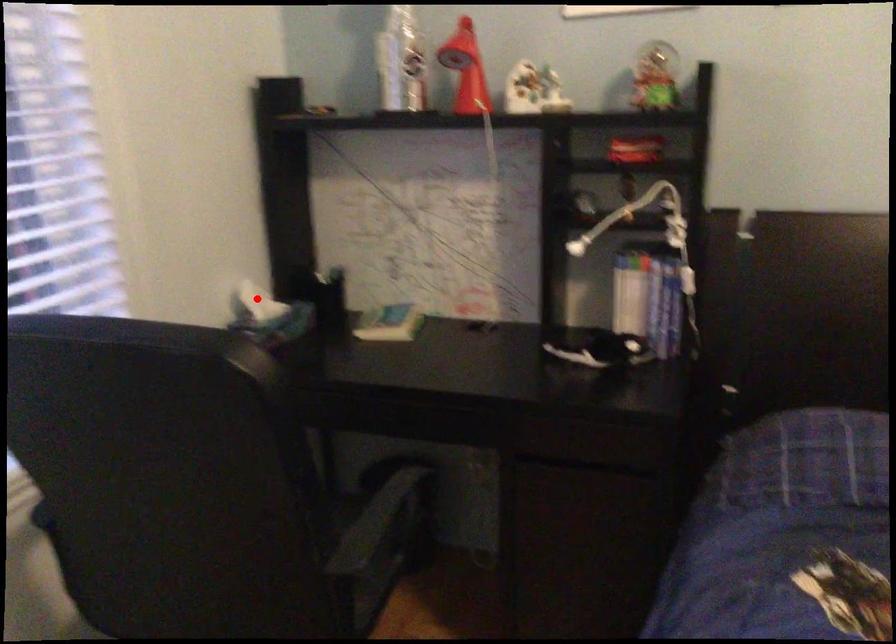
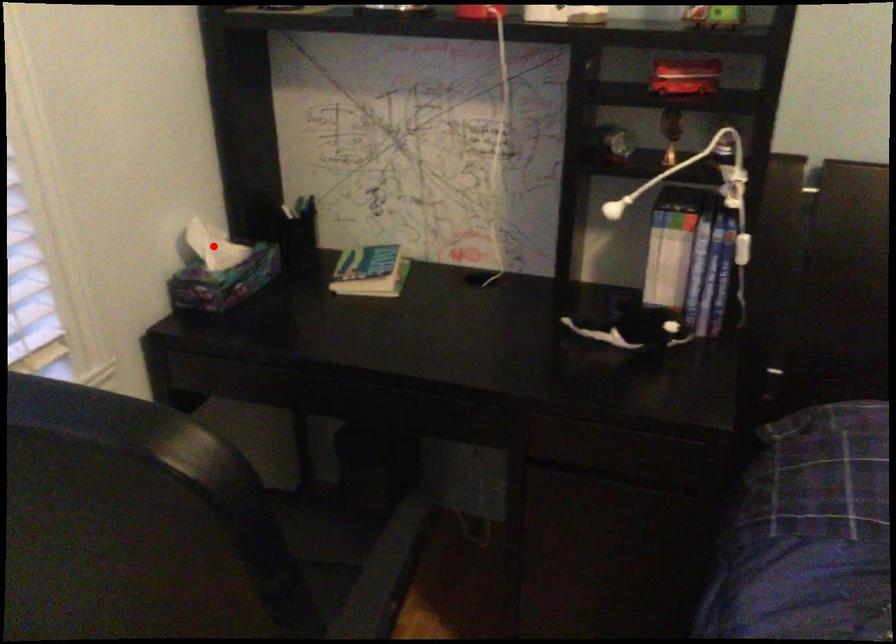
I am providing you with two images of the same scene from different viewpoints. A red point is marked on the first image and another point is marked on the second image. Do the highlighted points in image1 and image2 indicate the same real-world spot?

Yes